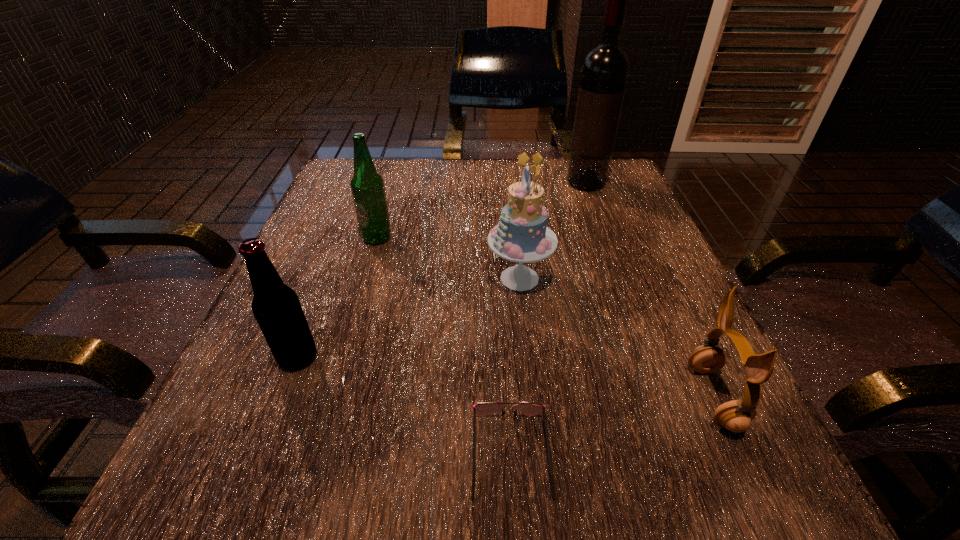
The width and height of the screenshot is (960, 540). I want to click on blank space that satisfies the following two spatial constraints: 1. on the front-facing side of the earphone; 2. on the bridge of the shortest object, so click(739, 453).